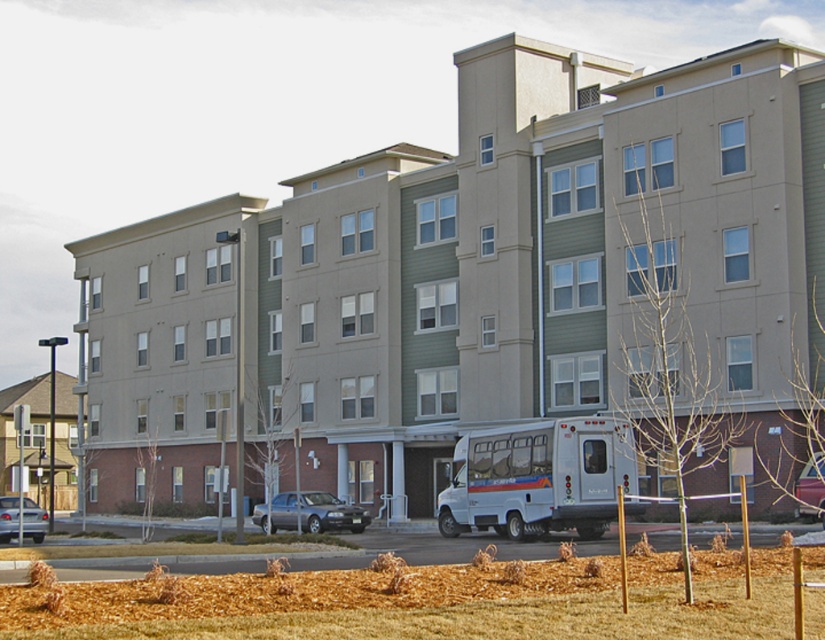
You are a pedestrian standing in front of the residential building. You see the silver metallic sedan at center and the metallic silver sedan at center. Which one is closer to the ground?

The silver metallic sedan at center is closer to the ground because it is located below the metallic silver sedan at center.

You are standing in front of the residential building and want to cross the street safely. There is a white matte bus at lower center and a silver metallic sedan at lower left. Which vehicle should you avoid stepping in front of while crossing?

You should avoid stepping in front of the white matte bus at lower center because it is closer to the viewer than the silver metallic sedan at lower left, making it a closer obstacle to navigate around.

You are a delivery person who needs to park your silver metallic sedan at center in the parking lot behind the building. However, there is already a metallic silver sedan at center parked there. Can you fit your car into the parking space if both cars are the same size?

The silver metallic sedan at center is bigger than metallic silver sedan at center, so your car cannot fit into the parking space because it is larger than the existing car.